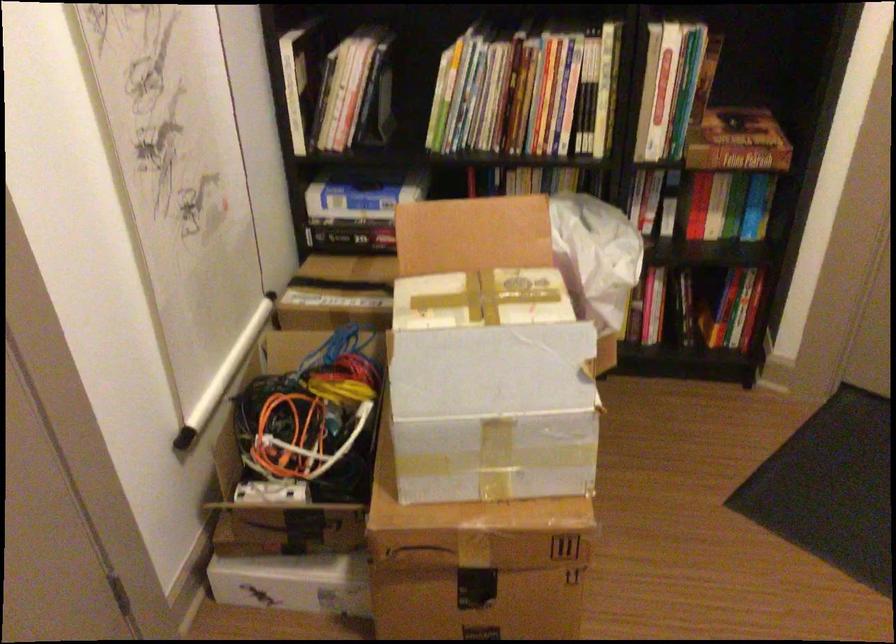
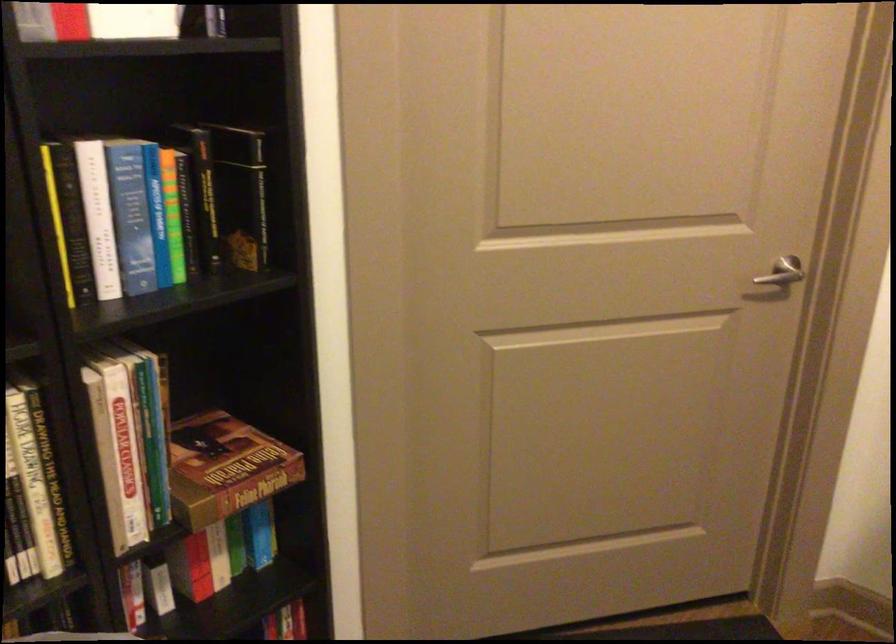
Question: The first image is from the beginning of the video and the second image is from the end. How did the camera likely rotate when shooting the video?

Choices:
 (A) Left
 (B) Right
 (C) Up
 (D) Down

Answer: (B)